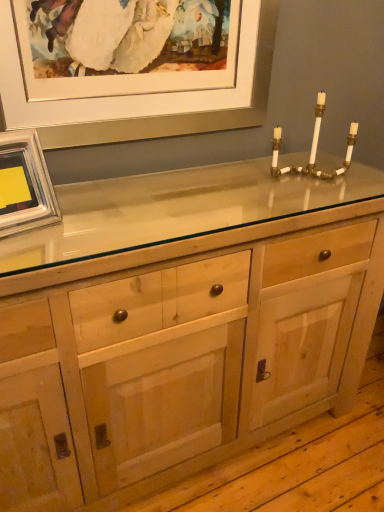
Question: Is natural wood cabinet at center surrounded by matte white picture frame at upper center, the 1th picture frame positioned from the top?

Choices:
 (A) no
 (B) yes

Answer: (A)

Question: From a real-world perspective, does matte white picture frame at upper center, the 1th picture frame positioned from the top, sit lower than natural wood cabinet at center?

Choices:
 (A) no
 (B) yes

Answer: (A)

Question: Is matte white picture frame at upper center, the 1th picture frame positioned from the top, to the right of natural wood cabinet at center from the viewer's perspective?

Choices:
 (A) yes
 (B) no

Answer: (B)

Question: Is matte white picture frame at upper center, the 1th picture frame positioned from the top, wider than natural wood cabinet at center?

Choices:
 (A) no
 (B) yes

Answer: (A)

Question: Does matte white picture frame at upper center, the 1th picture frame positioned from the top, touch natural wood cabinet at center?

Choices:
 (A) no
 (B) yes

Answer: (A)

Question: Do you think silver metallic picture frame at upper left, arranged as the 2th picture frame when viewed from the top, is within matte white picture frame at upper center, the 1th picture frame positioned from the top, or outside of it?

Choices:
 (A) inside
 (B) outside

Answer: (B)

Question: Is point coord(3,227) positioned closer to the camera than point coord(97,117)?

Choices:
 (A) closer
 (B) farther

Answer: (A)

Question: From their relative heights in the image, would you say silver metallic picture frame at upper left, arranged as the first picture frame when ordered from the bottom, is taller or shorter than matte white picture frame at upper center, arranged as the second picture frame when ordered from the bottom?

Choices:
 (A) tall
 (B) short

Answer: (B)

Question: From the image's perspective, is silver metallic picture frame at upper left, arranged as the 2th picture frame when viewed from the top, positioned above or below matte white picture frame at upper center, the 1th picture frame positioned from the top?

Choices:
 (A) above
 (B) below

Answer: (B)

Question: Based on their positions, is silver metallic picture frame at upper left, arranged as the first picture frame when ordered from the bottom, located to the left or right of natural wood cabinet at center?

Choices:
 (A) left
 (B) right

Answer: (A)

Question: Is silver metallic picture frame at upper left, arranged as the first picture frame when ordered from the bottom, spatially inside natural wood cabinet at center, or outside of it?

Choices:
 (A) inside
 (B) outside

Answer: (B)

Question: Is silver metallic picture frame at upper left, arranged as the 2th picture frame when viewed from the top, bigger or smaller than natural wood cabinet at center?

Choices:
 (A) big
 (B) small

Answer: (B)

Question: From the image's perspective, is silver metallic picture frame at upper left, arranged as the first picture frame when ordered from the bottom, positioned above or below natural wood cabinet at center?

Choices:
 (A) above
 (B) below

Answer: (A)

Question: Visually, is matte white picture frame at upper center, arranged as the second picture frame when ordered from the bottom, positioned to the left or to the right of natural wood cabinet at center?

Choices:
 (A) left
 (B) right

Answer: (A)

Question: Considering their positions, is matte white picture frame at upper center, the 1th picture frame positioned from the top, located in front of or behind natural wood cabinet at center?

Choices:
 (A) behind
 (B) front

Answer: (A)